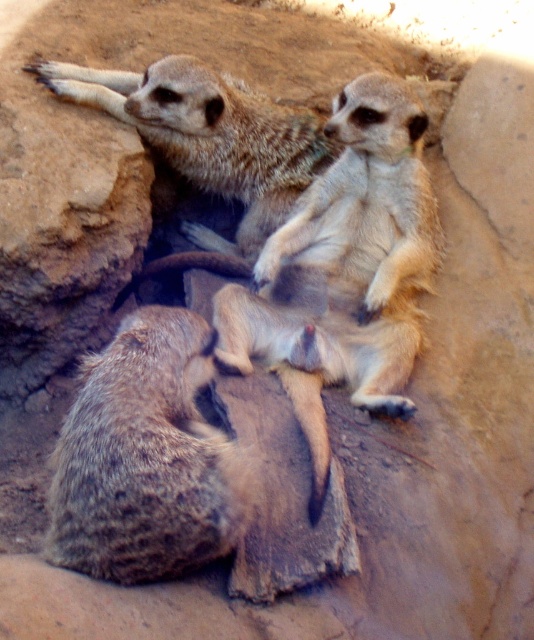
You are a wildlife photographer trying to capture a photo of the brown fuzzy meerkat at lower left and the fuzzy brown meerkat at upper center. Your camera has a maximum focus range of 28 inches. Can you fit both meerkats into the frame without moving the camera?

The brown fuzzy meerkat at lower left and the fuzzy brown meerkat at upper center are 28.56 inches apart. Since the distance between them exceeds the camera maximum focus range of 28 inches, you cannot fit both meerkats into the frame without moving the camera.

You are a photographer trying to capture a closeup of the meerkats. You are currently focused on the brown fuzzy meerkat at lower left. If you want to shift your focus to the fuzzy brown meerkat at upper center, which direction should you adjust your camera? Remember to consider their positions relative to you.

Since the brown fuzzy meerkat at lower left is closer to the viewer than the fuzzy brown meerkat at upper center, you should adjust your camera backward to focus on the fuzzy brown meerkat at upper center.